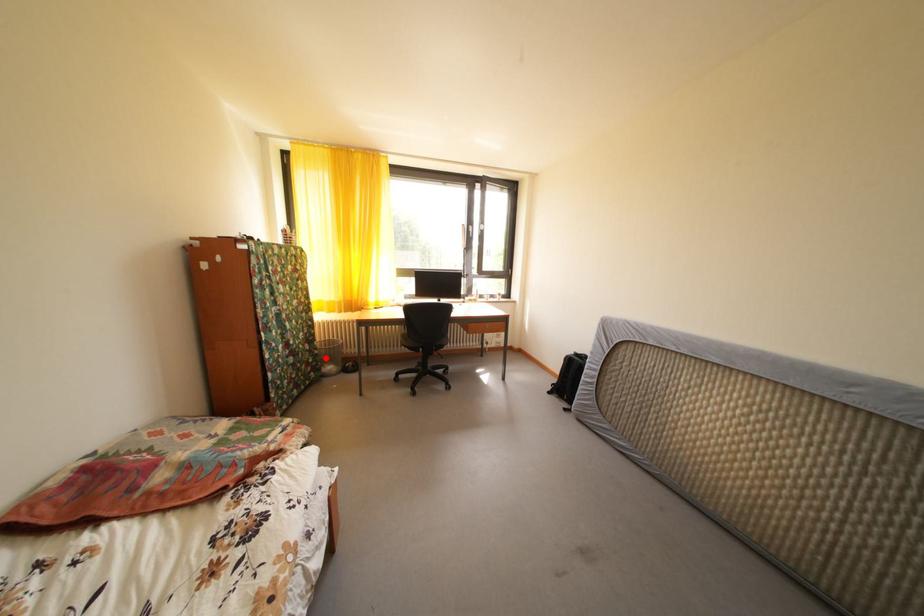
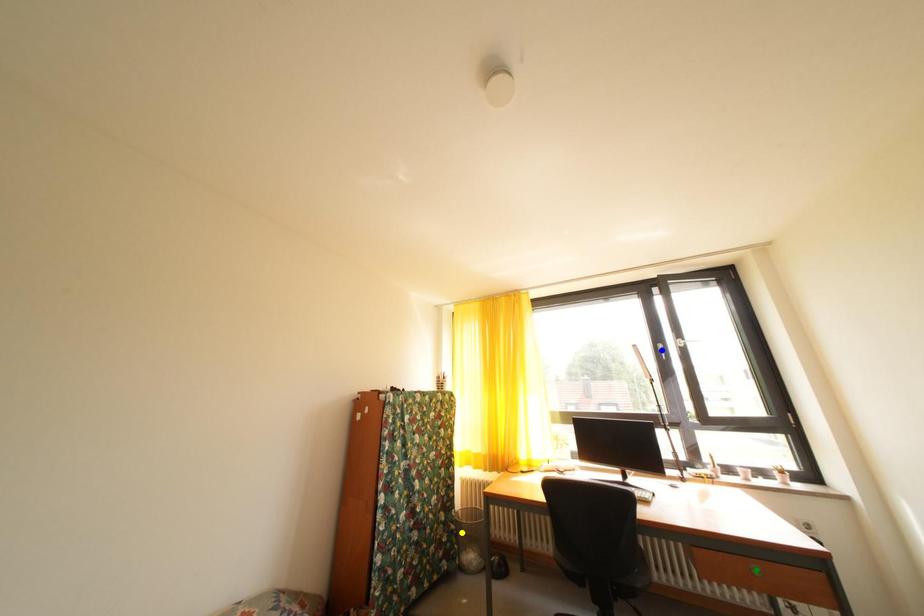
Question: I am providing you with two images of the same scene from different viewpoints. A red point is marked on the first image. You are given multiple points on the second image. Which spot in image 2 lines up with the point in image 1?

Choices:
 (A) green point
 (B) blue point
 (C) yellow point

Answer: (C)